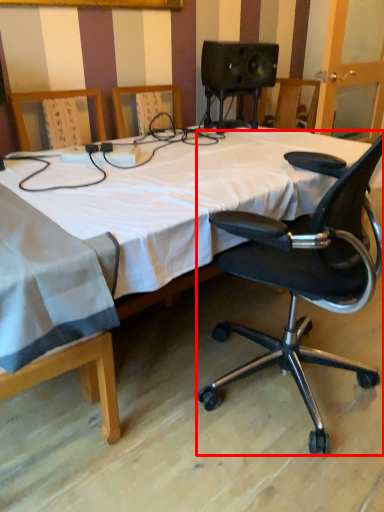
Question: From the image's perspective, where is chair (annotated by the red box) located in relation to bed in the image?

Choices:
 (A) above
 (B) below

Answer: (B)